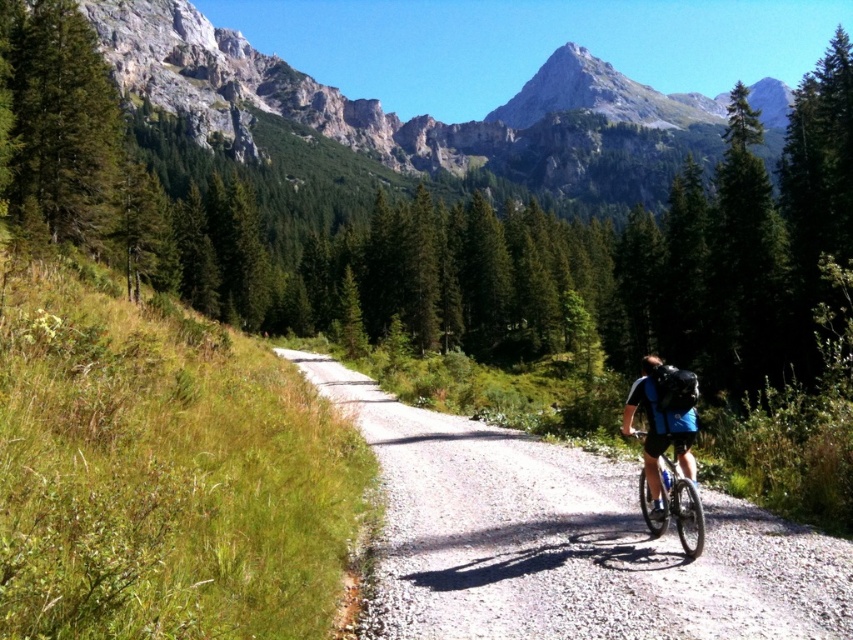
You are a cyclist who wants to take a photo of the gravel road at center. You are currently standing at point (566, 540). Is this point the correct location to take the photo?

Yes, the point (566, 540) corresponds to the gravel road at center, so this is the correct location to take the photo.

You are standing at the point marked as point (148, 12) on the mountain biking trail. The trail is narrow and surrounded by dense trees on the right and open grass on the left. If you want to move closer to the cyclist who is riding away from you towards the mountains, should you move towards the left or right side of the trail?

Since the point (148, 12) is 739.09 feet from the viewer, moving towards the left side of the trail would allow you to get closer to the cyclist as the left side has more open space compared to the denser vegetation on the right. However, the exact direction depends on the cyclist path and trail layout beyond the current view.